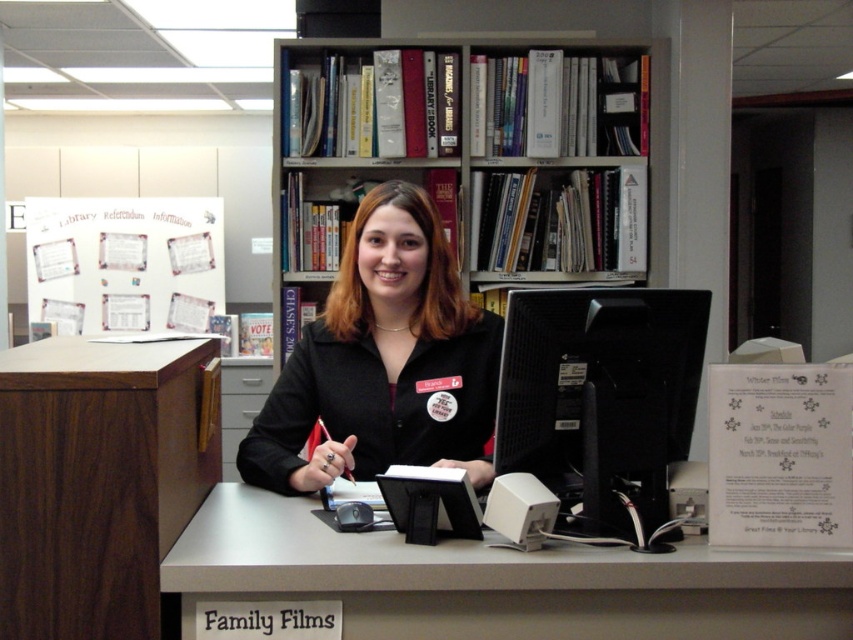
Can you confirm if walnut wood file cabinet at left is positioned below black matte monitor at center?

Yes.

Can you confirm if walnut wood file cabinet at left is positioned to the right of black matte monitor at center?

Incorrect, walnut wood file cabinet at left is not on the right side of black matte monitor at center.

Find the location of a particular element. walnut wood file cabinet at left is located at coordinates (97, 481).

Can you confirm if wooden bookshelf at upper center is wider than white paper at upper left?

Yes.

Describe the element at coordinates (469, 157) in the screenshot. I see `wooden bookshelf at upper center` at that location.

Identify the location of wooden bookshelf at upper center. (469, 157).

Is matte black jacket at center thinner than black matte monitor at center?

Incorrect, matte black jacket at center's width is not less than black matte monitor at center's.

Is point (405, 220) closer to viewer compared to point (621, 291)?

No, it is not.

Image resolution: width=853 pixels, height=640 pixels. What are the coordinates of `matte black jacket at center` in the screenshot? It's located at (383, 362).